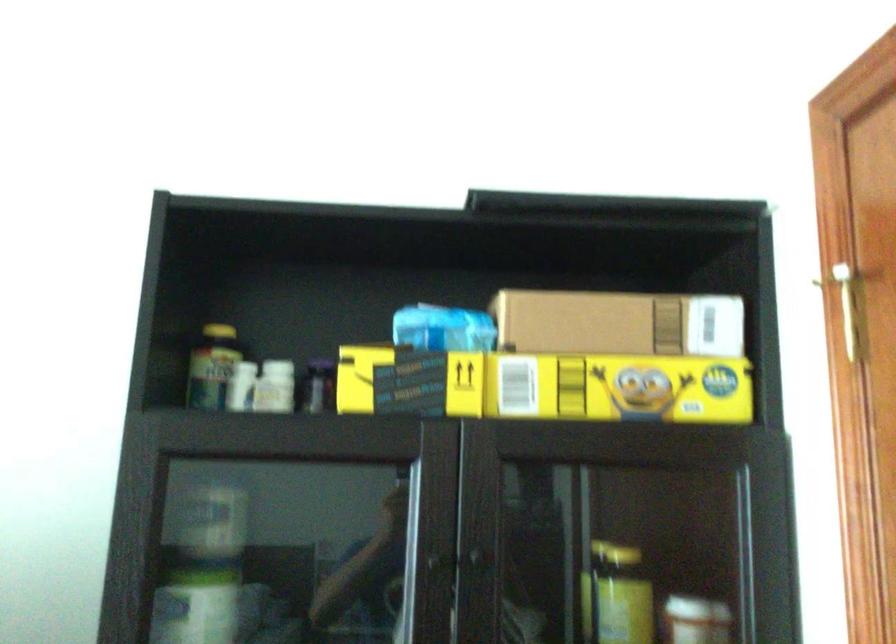
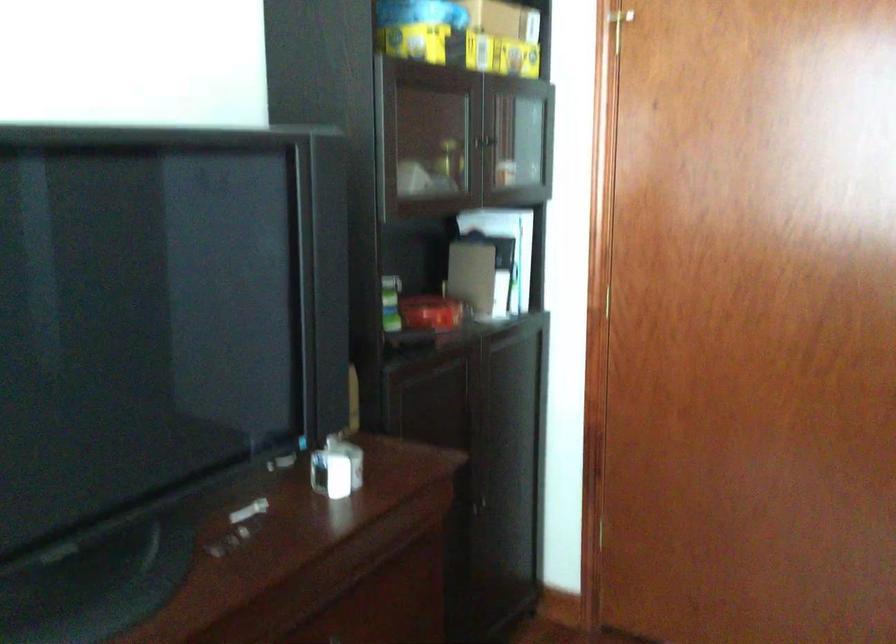
In the second image, find the point that corresponds to pixel 599 393 in the first image.

(502, 55)